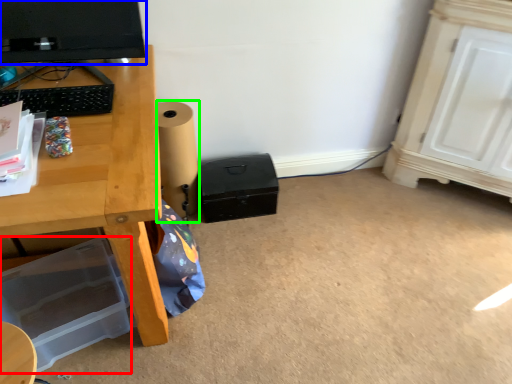
Question: Based on their relative distances, which object is nearer to box (highlighted by a red box)? Choose from computer monitor (highlighted by a blue box) and speaker (highlighted by a green box).

Choices:
 (A) computer monitor
 (B) speaker

Answer: (B)